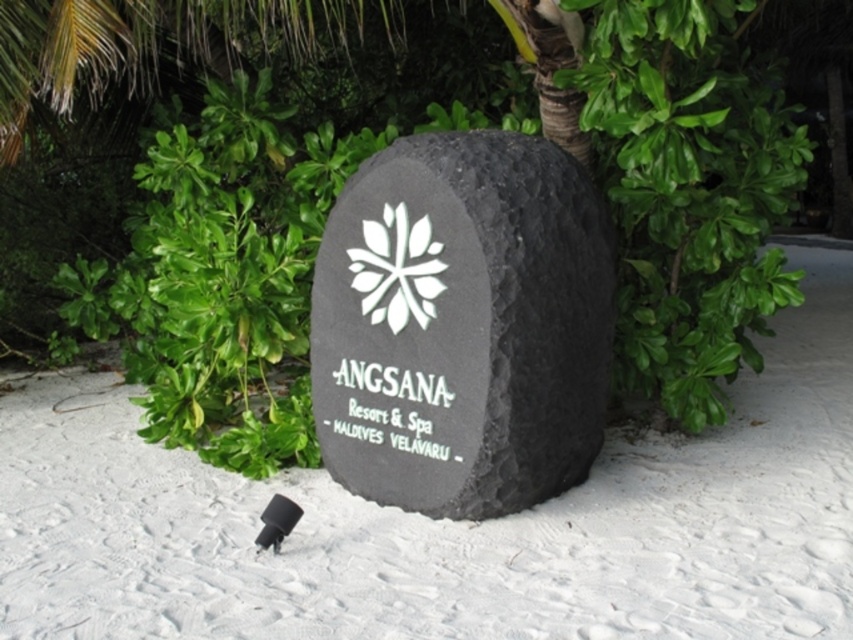
You are standing at the point marked as point (448, 524). What is the material under your feet?

The material under your feet at point (448, 524) is white sand at center.

You are a visitor at the resort and want to take a photo of both the green leafy tree at center and the black stone sign at center. Which object should you focus on first to ensure both are in frame?

The green leafy tree at center is bigger than the black stone sign at center, so you should focus on the black stone sign at center first to ensure both fit in the frame.

You are a maintenance worker at the resort and need to place a 12 inch long maintenance tool between the white sand at center and the black stone sign at center. Can you fit the tool horizontally between them without moving either object?

The distance between the white sand at center and the black stone sign at center is 25.44 inches. Since the tool is 12 inches long, it can fit horizontally between them as the space is larger than the tool.